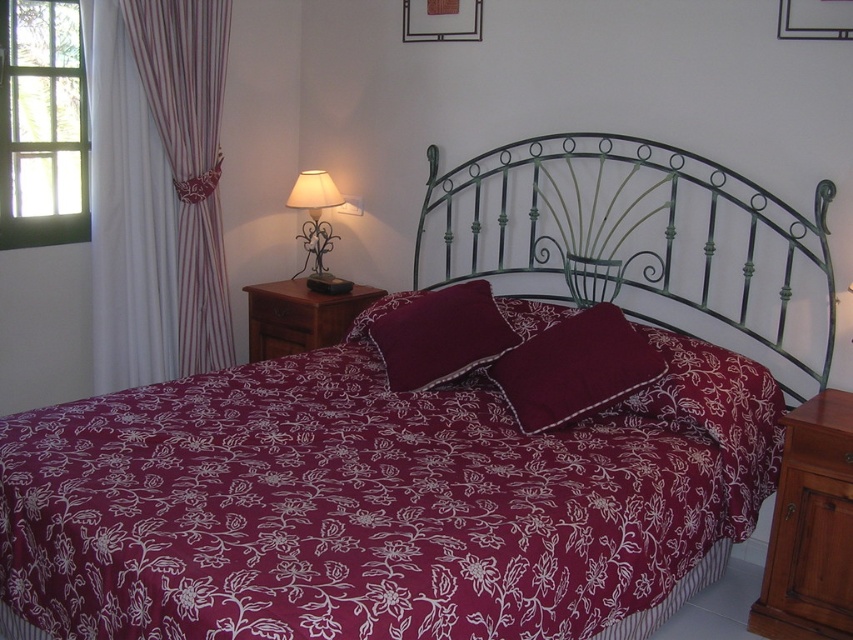
You are arranging a photo shoot in this bedroom and need to place a camera on the bed. The camera requires a surface wider than the metallic wrought iron lamp at upper right. Can the maroon fabric pillow at center provide enough space for the camera?

The maroon fabric pillow at center is wider than the metallic wrought iron lamp at upper right, so it can provide enough space for the camera.

You are arranging a photo shoot in this bedroom and need to place a small decorative item between the maroon fabric pillow at center and the metallic wrought iron lamp at upper right. Which object should the item be placed closer to to ensure it fits better in the scene?

The small decorative item should be placed closer to the maroon fabric pillow at center because it has a smaller size compared to the metallic wrought iron lamp at upper right, allowing for better spatial balance.

You are planning to replace the striped fabric curtain at left with a new one. The current metallic wrought iron lamp at upper right is 1.2 meters wide. Can the new curtain fit if it is 1 meter wide?

The striped fabric curtain at left is currently narrower than the metallic wrought iron lamp at upper right. Since the lamp is 1.2 meters wide, the curtain is less than that. A new curtain of 1 meter wide would fit as it is narrower than the existing width.